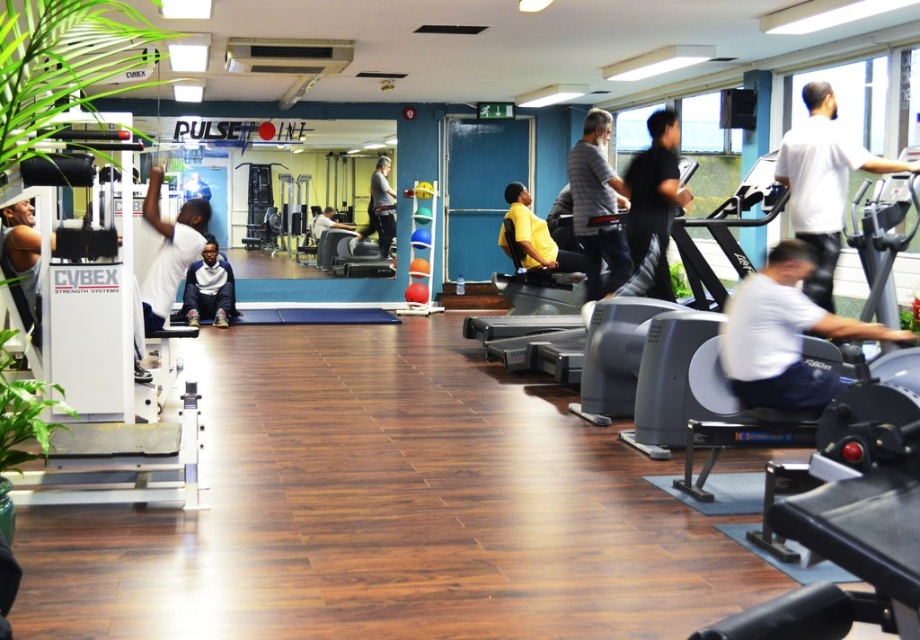
Between white plastic treadmill at left and yellow fabric at center, which one is positioned lower?

white plastic treadmill at left is below.

Does white plastic treadmill at left have a smaller size compared to yellow fabric at center?

Actually, white plastic treadmill at left might be larger than yellow fabric at center.

Between point (187, 227) and point (472, 323), which one is positioned behind?

The point (472, 323) is more distant.

The image size is (920, 640). In order to click on white plastic treadmill at left in this screenshot , I will do click(109, 388).

Which is above, white plastic treadmill at left or black matte shirt at center?

Positioned higher is black matte shirt at center.

Does white plastic treadmill at left come behind black matte shirt at center?

No, white plastic treadmill at left is in front of black matte shirt at center.

The width and height of the screenshot is (920, 640). What are the coordinates of `white plastic treadmill at left` in the screenshot? It's located at (109, 388).

Between white matte shirt at right and matte black weight bench at center, which one is positioned higher?

matte black weight bench at center is higher up.

Which of these two, white matte shirt at right or matte black weight bench at center, stands shorter?

With less height is matte black weight bench at center.

Find the location of a particular element. The height and width of the screenshot is (640, 920). white matte shirt at right is located at coordinates (823, 182).